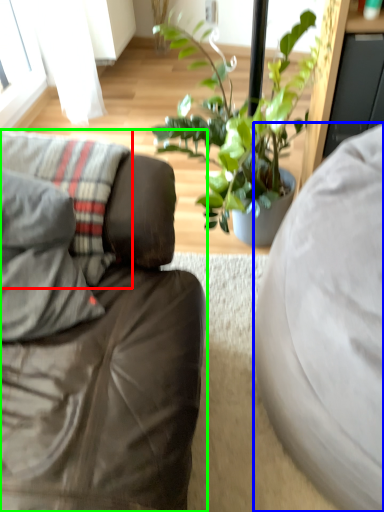
Question: Based on their relative distances, which object is nearer to pillow (highlighted by a red box)? Choose from studio couch (highlighted by a blue box) and studio couch (highlighted by a green box).

Choices:
 (A) studio couch
 (B) studio couch

Answer: (B)